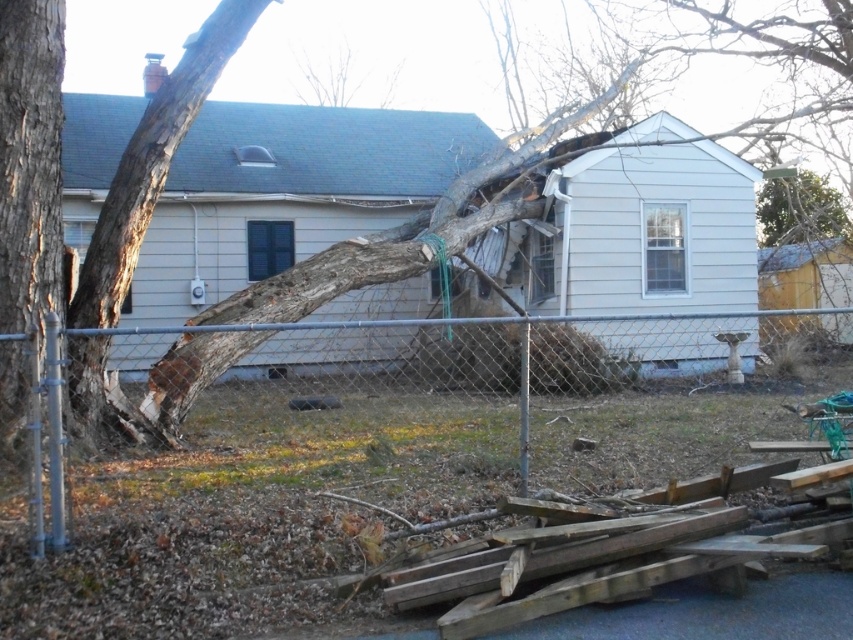
Does metallic chain-link fence at center have a lesser width compared to smooth brown bark at left?

In fact, metallic chain-link fence at center might be wider than smooth brown bark at left.

Between metallic chain-link fence at center and smooth brown bark at left, which one has less height?

With less height is metallic chain-link fence at center.

Which is in front, point (474, 339) or point (62, 44)?

Positioned in front is point (62, 44).

This screenshot has height=640, width=853. Identify the location of metallic chain-link fence at center. (427, 426).